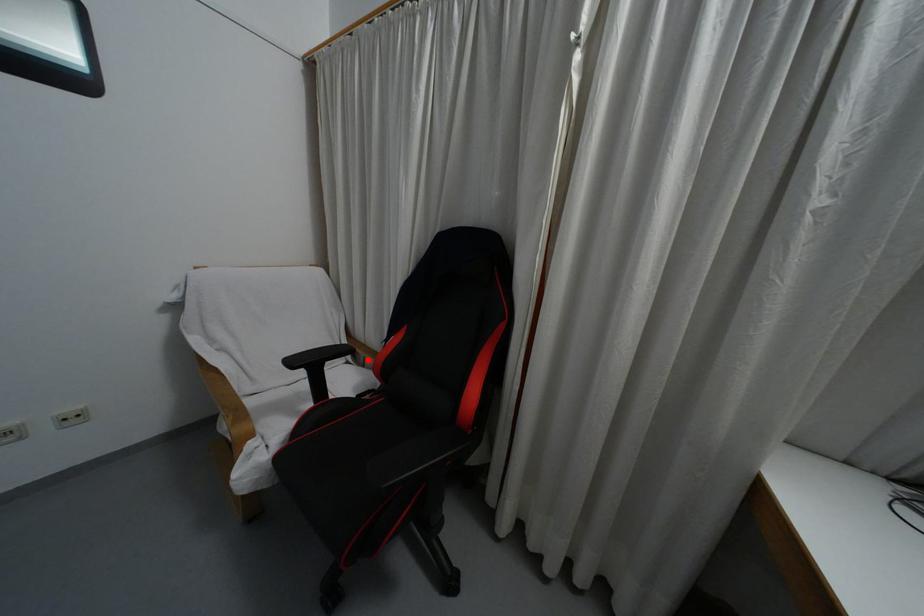
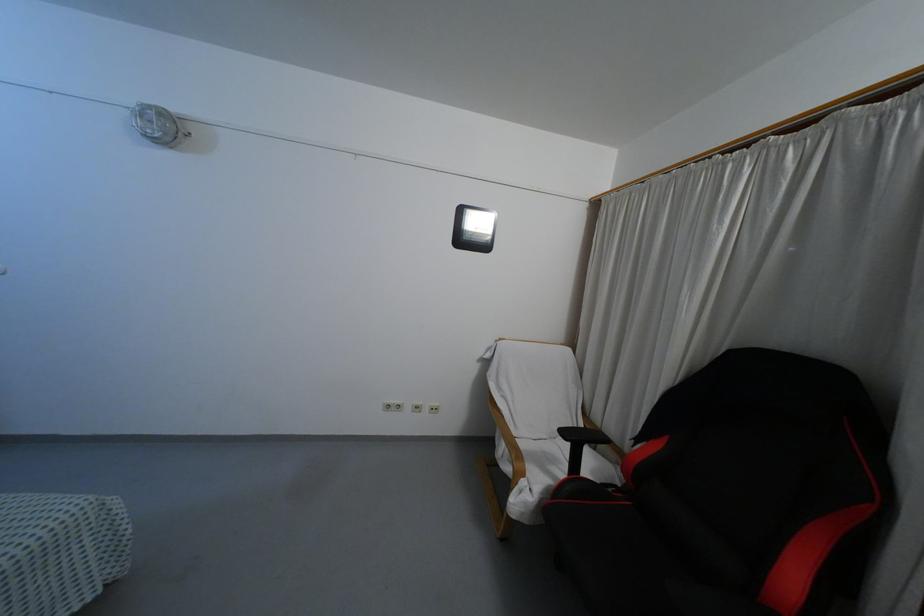
Question: I am providing you with two images of the same scene from different viewpoints. A red point is shown in image1. For the corresponding object point in image2, is it positioned nearer or farther from the camera?

Choices:
 (A) Nearer
 (B) Farther

Answer: (A)